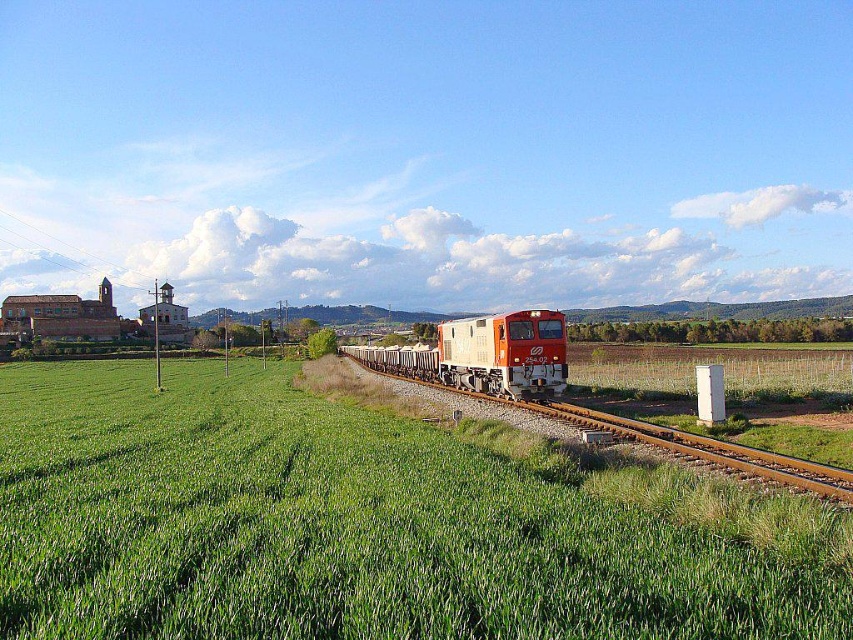
Does green grass at center appear over matte orange train at center?

No, green grass at center is not above matte orange train at center.

Is point (91, 387) in front of point (514, 344)?

No, (91, 387) is further to viewer.

This screenshot has width=853, height=640. In order to click on green grass at center in this screenshot , I will do `click(373, 522)`.